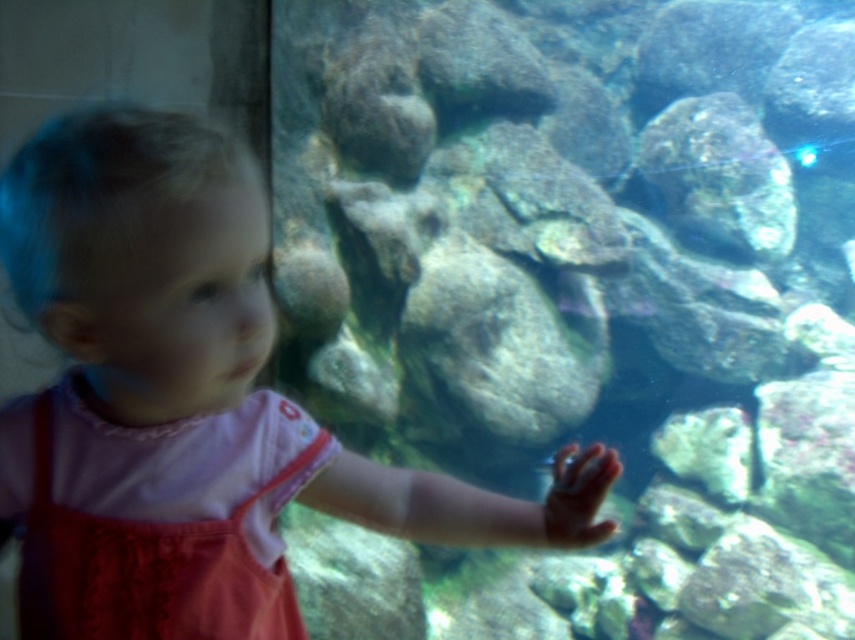
Question: Which point is closer to the camera?

Choices:
 (A) (162, 604)
 (B) (266, 339)

Answer: (B)

Question: Can you confirm if pink fabric at center is positioned to the left of pink cotton dress at center?

Choices:
 (A) yes
 (B) no

Answer: (B)

Question: Does pink fabric at center appear over pink cotton dress at center?

Choices:
 (A) yes
 (B) no

Answer: (A)

Question: Is pink fabric at center positioned at the back of pink cotton dress at center?

Choices:
 (A) no
 (B) yes

Answer: (A)